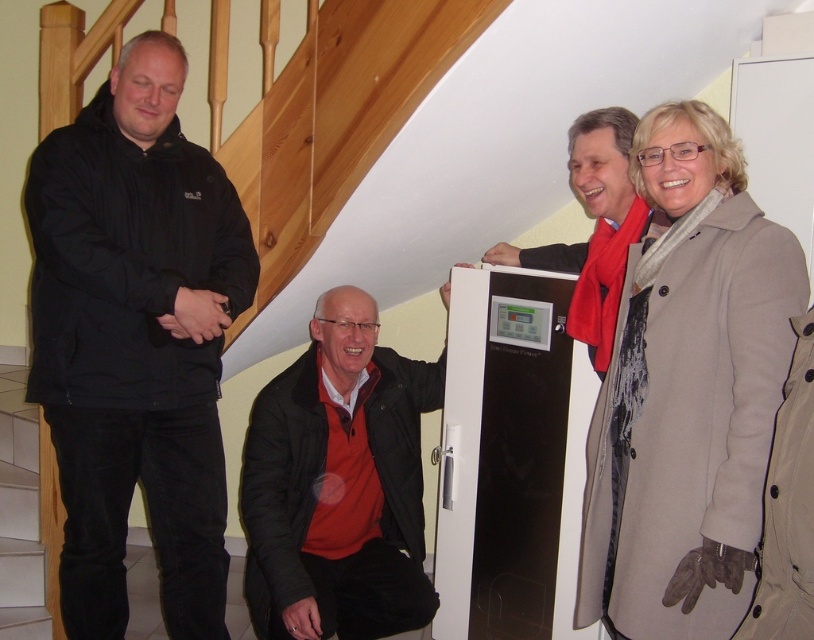
Question: Which of the following is the closest to the observer?

Choices:
 (A) beige wool coat at upper right
 (B) matte black jacket at upper right
 (C) black matte jacket at left

Answer: (A)

Question: Does beige wool coat at upper right appear on the left side of matte black jacket at upper right?

Choices:
 (A) no
 (B) yes

Answer: (A)

Question: Observing the image, what is the correct spatial positioning of black matte jacket at center in reference to matte black jacket at upper right?

Choices:
 (A) right
 (B) left

Answer: (B)

Question: Estimate the real-world distances between objects in this image. Which object is closer to the black matte jacket at center?

Choices:
 (A) beige wool coat at upper right
 (B) black matte jacket at left
 (C) matte black jacket at upper right

Answer: (B)

Question: Can you confirm if black matte jacket at left is positioned below beige wool coat at upper right?

Choices:
 (A) no
 (B) yes

Answer: (A)

Question: Which of the following is the farthest from the observer?

Choices:
 (A) black matte jacket at center
 (B) black matte jacket at left
 (C) matte black jacket at upper right

Answer: (A)